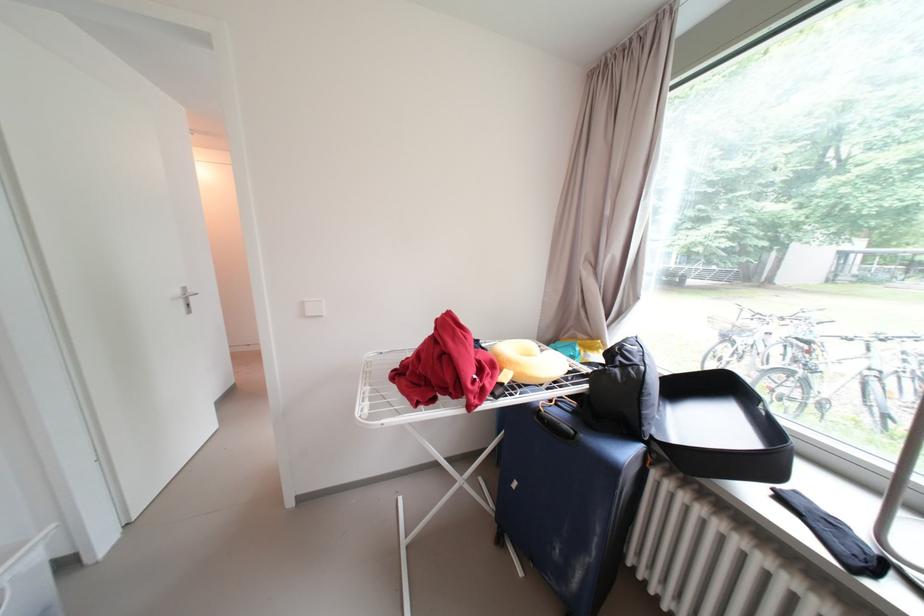
Image resolution: width=924 pixels, height=616 pixels. Find the location of `suitcase handle`. suitcase handle is located at coordinates tap(554, 423).